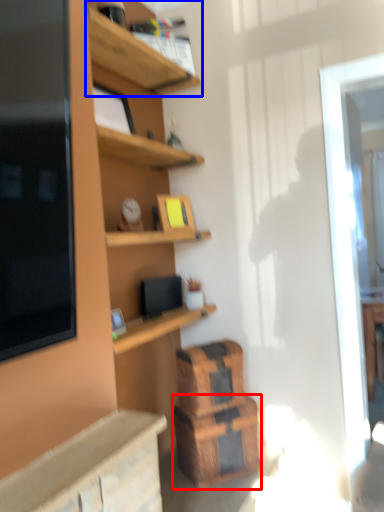
Question: Among these objects, which one is farthest to the camera, crate (highlighted by a red box) or shelf (highlighted by a blue box)?

Choices:
 (A) crate
 (B) shelf

Answer: (B)